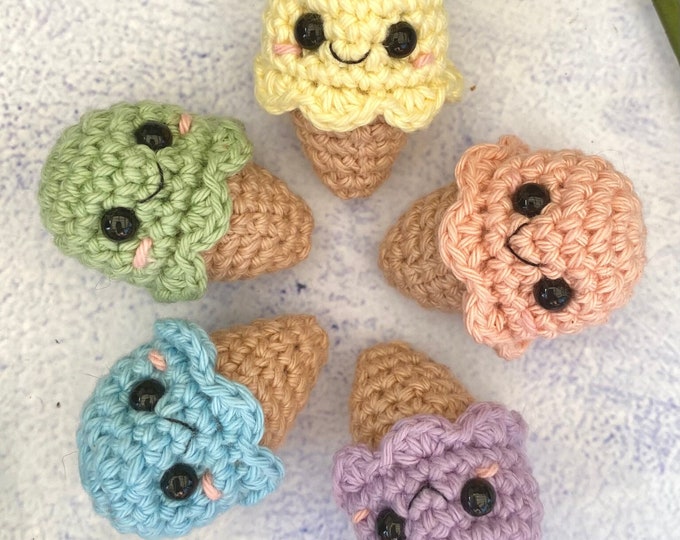
The height and width of the screenshot is (540, 680). I want to click on fabric in background, so click(129, 49).